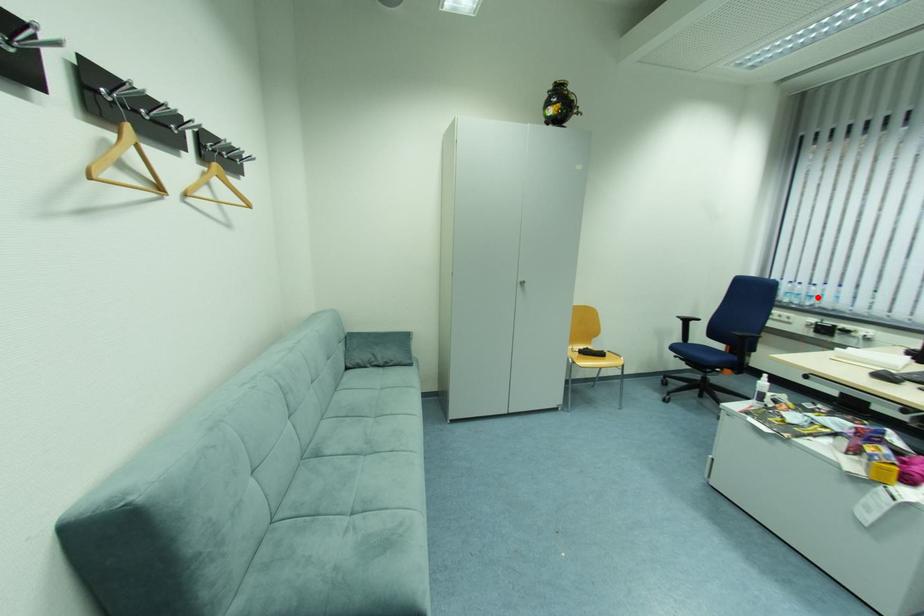
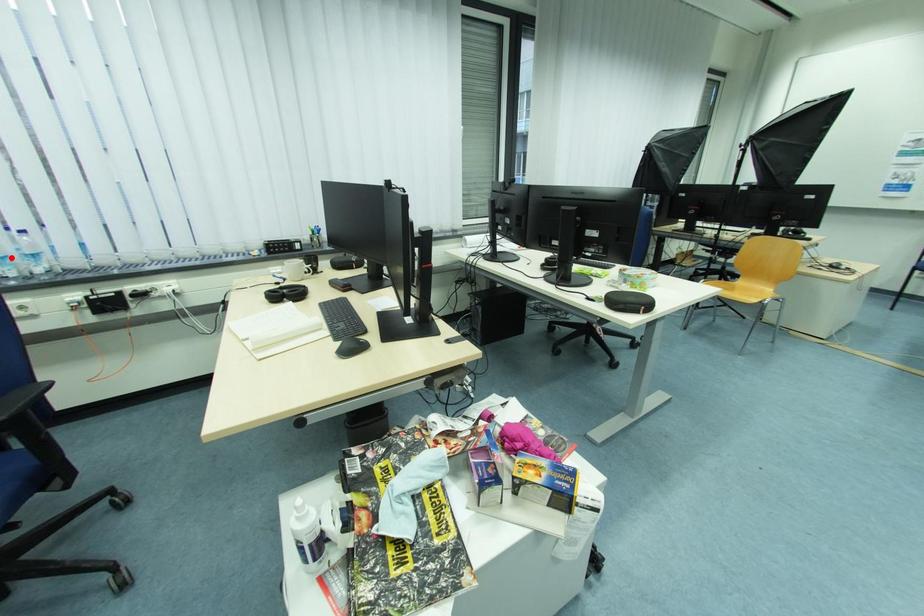
I am providing you with two images of the same scene from different viewpoints. A red point is marked on the first image and another point is marked on the second image. Does the point marked in image1 correspond to the same location as the one in image2?

No